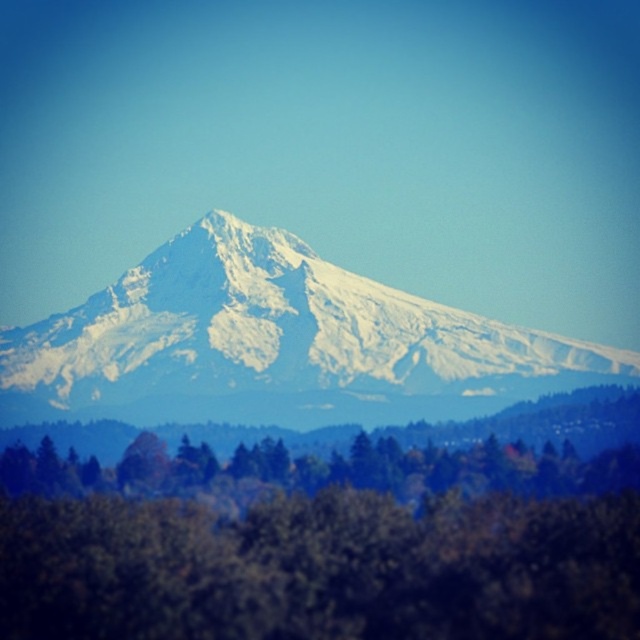
Question: Can you confirm if green matte tree at center is positioned to the left of white snow-covered mountain at center?

Choices:
 (A) no
 (B) yes

Answer: (B)

Question: Which of the following is the closest to the observer?

Choices:
 (A) (77, 540)
 (B) (552, 342)

Answer: (B)

Question: Is green matte tree at center wider than white snow-covered mountain at center?

Choices:
 (A) yes
 (B) no

Answer: (A)

Question: Is green matte tree at center above white snow-covered mountain at center?

Choices:
 (A) yes
 (B) no

Answer: (B)

Question: Which object is closer to the camera taking this photo?

Choices:
 (A) white snow-covered mountain at center
 (B) green matte tree at center

Answer: (A)